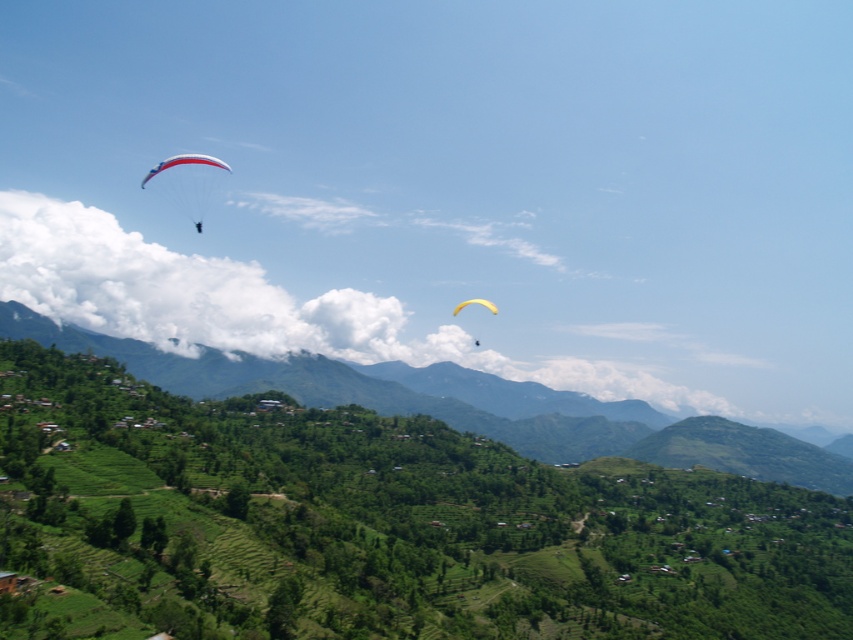
Measure the distance from green terraced field at center to yellow matte parachute at upper center.

A distance of 172.24 meters exists between green terraced field at center and yellow matte parachute at upper center.

Is green terraced field at center to the right of yellow matte parachute at upper center from the viewer's perspective?

No, green terraced field at center is not to the right of yellow matte parachute at upper center.

Locate an element on the screen. green terraced field at center is located at coordinates (451, 406).

Which of these two, matte red and white parachute at upper left or yellow matte parachute at upper center, stands taller?

matte red and white parachute at upper left

Is matte red and white parachute at upper left positioned before yellow matte parachute at upper center?

That is False.

Locate an element on the screen. The height and width of the screenshot is (640, 853). matte red and white parachute at upper left is located at coordinates (187, 180).

Does green terraced field at center lie in front of matte red and white parachute at upper left?

Yes, green terraced field at center is closer to the viewer.

At what (x,y) coordinates should I click in order to perform the action: click on green terraced field at center. Please return your answer as a coordinate pair (x, y). Looking at the image, I should click on (451, 406).

This screenshot has width=853, height=640. What are the coordinates of `green terraced field at center` in the screenshot? It's located at (451, 406).